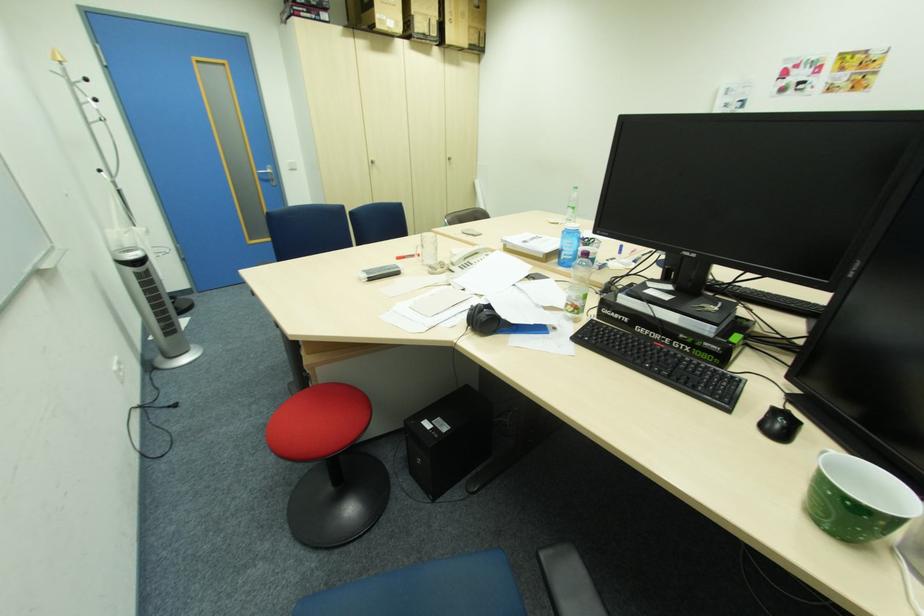
Locate an element on the screen. Image resolution: width=924 pixels, height=616 pixels. blue chair sitting surface is located at coordinates (426, 591).